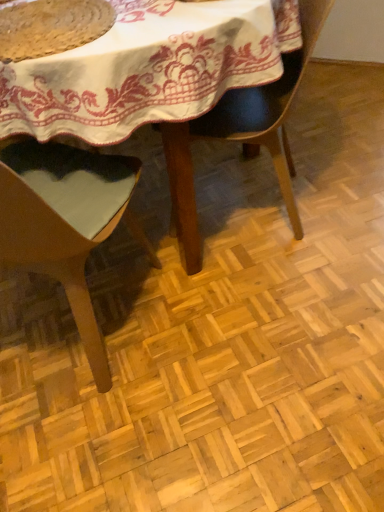
This screenshot has height=512, width=384. I want to click on vacant space underneath light brown wood chair at center, which ranks as the 1th chair in left-to-right order (from a real-world perspective), so click(x=74, y=333).